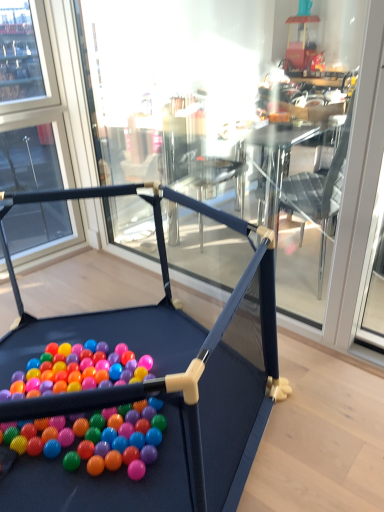
Question: Should I look upward or downward to see matte black playpen at center?

Choices:
 (A) up
 (B) down

Answer: (B)